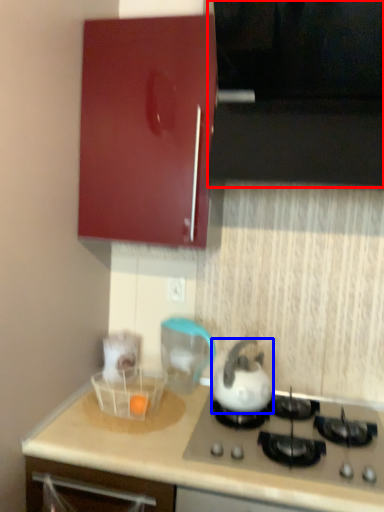
Question: Which of the following is the farthest to the observer, vent (highlighted by a red box) or kettle (highlighted by a blue box)?

Choices:
 (A) vent
 (B) kettle

Answer: (B)